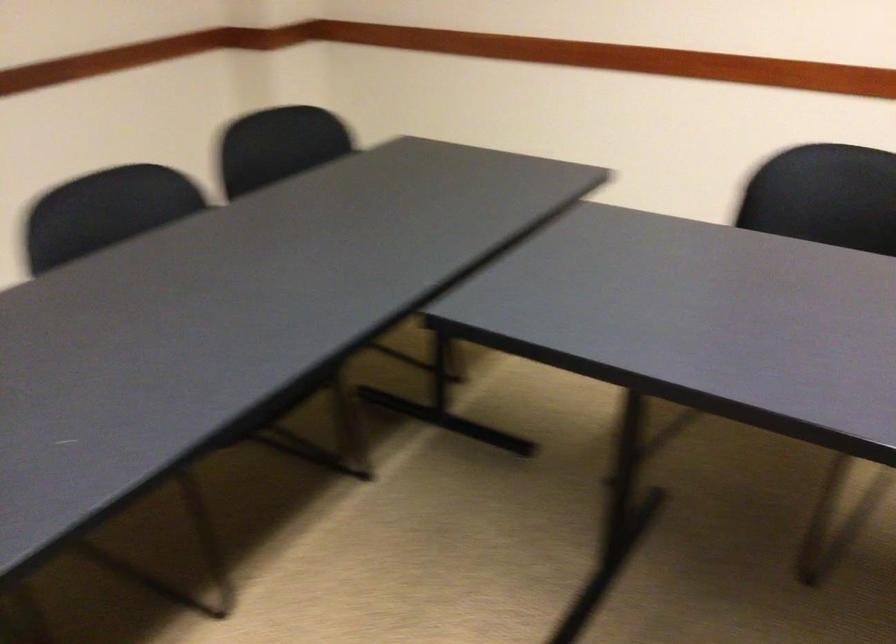
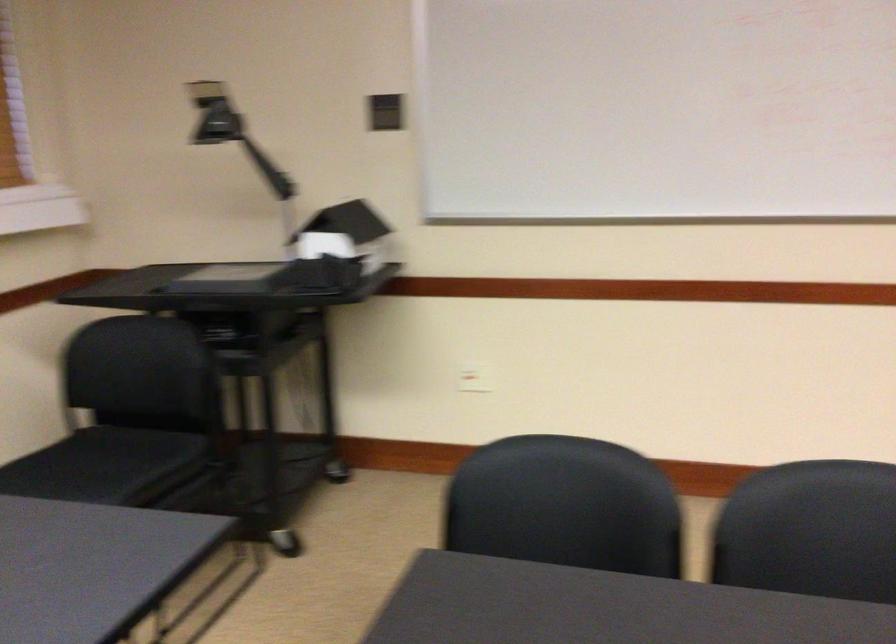
Based on the continuous images, in which direction is the camera rotating?

The camera rotated toward right-down.